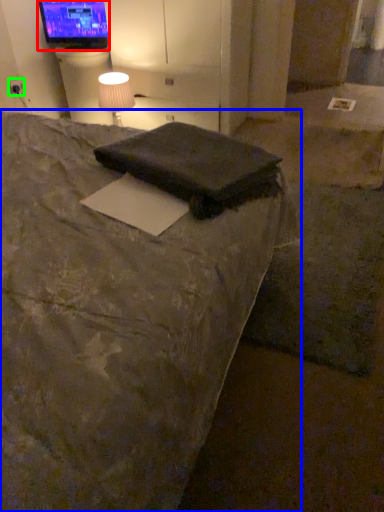
Question: Based on their relative distances, which object is nearer to television (highlighted by a red box)? Choose from bed (highlighted by a blue box) and electric outlet (highlighted by a green box).

Choices:
 (A) bed
 (B) electric outlet

Answer: (B)